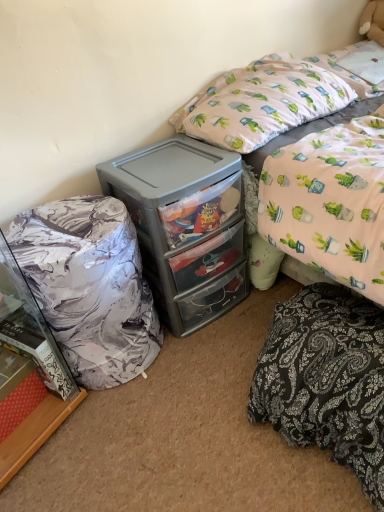
Question: From a real-world perspective, does gray plastic chest of drawers at center sit lower than marble-patterned bean bag at left?

Choices:
 (A) no
 (B) yes

Answer: (A)

Question: Can you confirm if gray plastic chest of drawers at center is bigger than marble-patterned bean bag at left?

Choices:
 (A) yes
 (B) no

Answer: (A)

Question: Is gray plastic chest of drawers at center thinner than marble-patterned bean bag at left?

Choices:
 (A) yes
 (B) no

Answer: (B)

Question: Are gray plastic chest of drawers at center and marble-patterned bean bag at left making contact?

Choices:
 (A) no
 (B) yes

Answer: (A)

Question: Does gray plastic chest of drawers at center have a smaller size compared to marble-patterned bean bag at left?

Choices:
 (A) yes
 (B) no

Answer: (B)

Question: From the image's perspective, is pink fabric pillow at upper right positioned above or below black paisley fabric at lower right?

Choices:
 (A) below
 (B) above

Answer: (B)

Question: Considering the positions of pink fabric pillow at upper right and black paisley fabric at lower right in the image, is pink fabric pillow at upper right taller or shorter than black paisley fabric at lower right?

Choices:
 (A) tall
 (B) short

Answer: (B)

Question: In the image, is pink fabric pillow at upper right on the left side or the right side of black paisley fabric at lower right?

Choices:
 (A) right
 (B) left

Answer: (B)

Question: From a real-world perspective, relative to black paisley fabric at lower right, is pink fabric pillow at upper right vertically above or below?

Choices:
 (A) above
 (B) below

Answer: (A)

Question: From the image's perspective, is marble-patterned bean bag at left positioned above or below pink fabric pillow at upper right?

Choices:
 (A) below
 (B) above

Answer: (A)

Question: In terms of height, does marble-patterned bean bag at left look taller or shorter compared to pink fabric pillow at upper right?

Choices:
 (A) short
 (B) tall

Answer: (B)

Question: Is marble-patterned bean bag at left to the left or to the right of pink fabric pillow at upper right in the image?

Choices:
 (A) right
 (B) left

Answer: (B)

Question: Considering the positions of point (51, 262) and point (297, 122), is point (51, 262) closer or farther from the camera than point (297, 122)?

Choices:
 (A) farther
 (B) closer

Answer: (B)

Question: Is black paisley fabric at lower right in front of or behind pink fabric bed at upper right in the image?

Choices:
 (A) front
 (B) behind

Answer: (A)

Question: In terms of width, does black paisley fabric at lower right look wider or thinner when compared to pink fabric bed at upper right?

Choices:
 (A) wide
 (B) thin

Answer: (B)